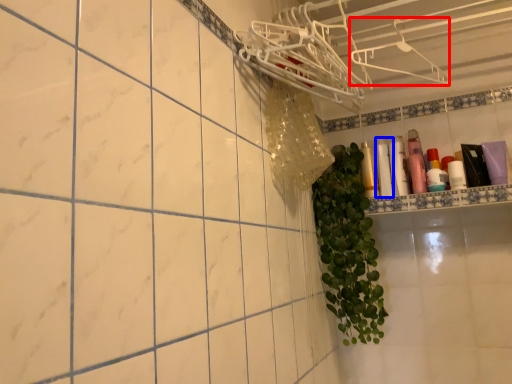
Question: Which object appears farthest to the camera in this image, hanger (highlighted by a red box) or toiletry (highlighted by a blue box)?

Choices:
 (A) hanger
 (B) toiletry

Answer: (B)